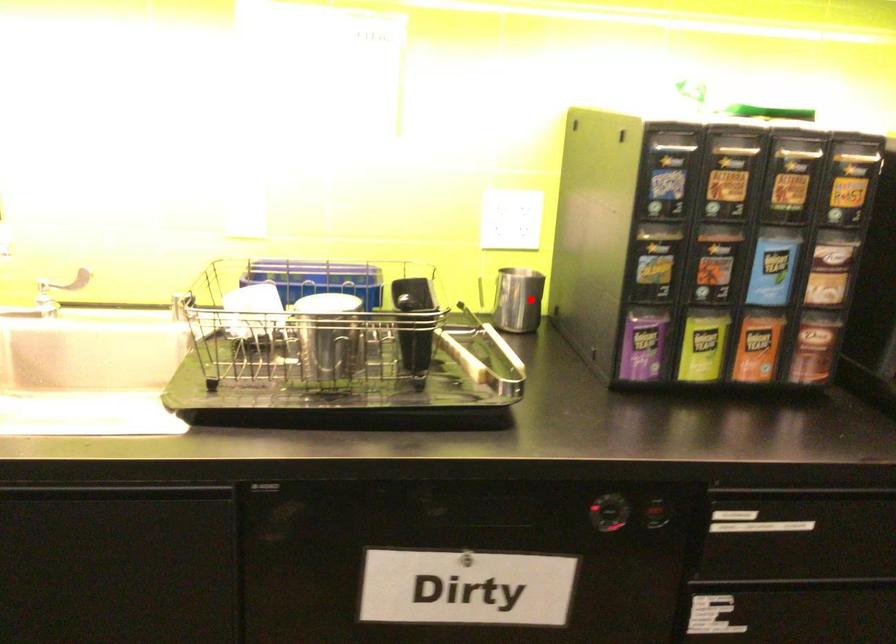
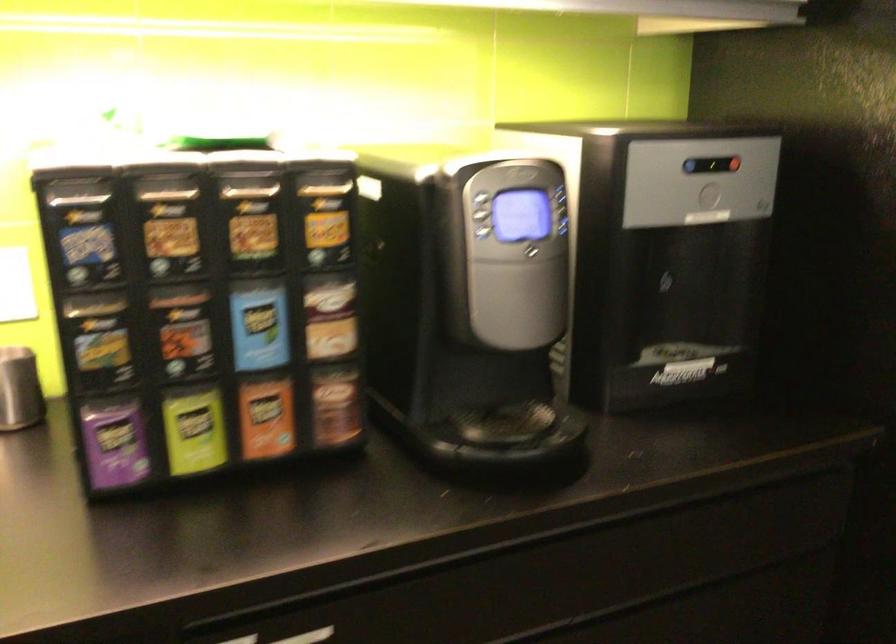
Question: I am providing you with two images of the same scene from different viewpoints. Image1 has a red point marked. In image2, the corresponding 3D location appears at what relative position? Reply with the corresponding letter.

Choices:
 (A) Closer
 (B) Farther

Answer: (A)